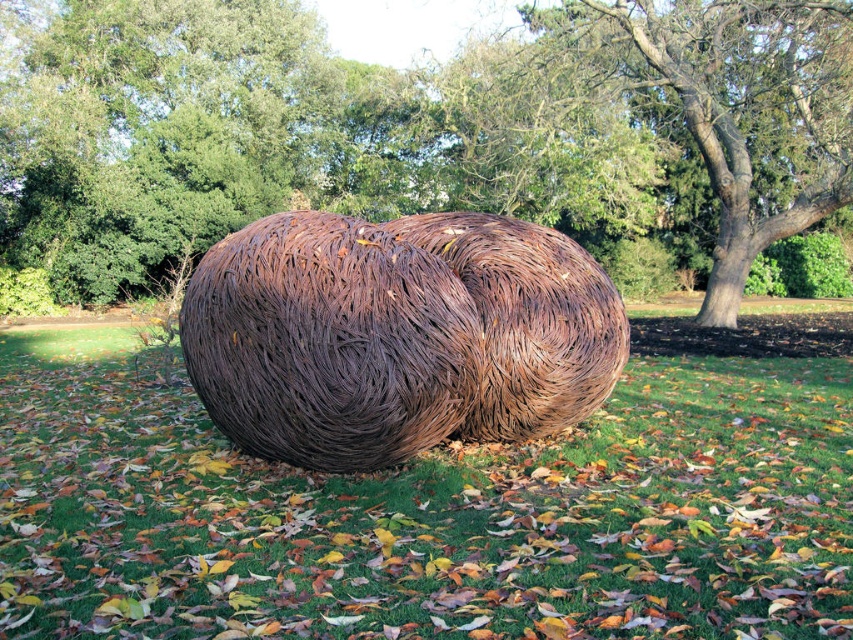
Question: From the image, what is the correct spatial relationship of brown textured sculpture at center in relation to brown textured tree at center?

Choices:
 (A) left
 (B) right

Answer: (A)

Question: Is green grass at center to the left of brown textured tree at center from the viewer's perspective?

Choices:
 (A) no
 (B) yes

Answer: (B)

Question: Which object is closer to the camera taking this photo?

Choices:
 (A) green grass at center
 (B) rusty wire sculpture at center

Answer: (A)

Question: Does green grass at center come behind brown textured tree at center?

Choices:
 (A) no
 (B) yes

Answer: (A)

Question: Estimate the real-world distances between objects in this image. Which object is farther from the brown textured sculpture at center?

Choices:
 (A) brown textured tree at center
 (B) green grass at center
 (C) rusty wire sculpture at center

Answer: (B)

Question: Considering the real-world distances, which object is closest to the brown textured sculpture at center?

Choices:
 (A) rusty wire sculpture at center
 (B) green grass at center
 (C) brown textured tree at center

Answer: (C)